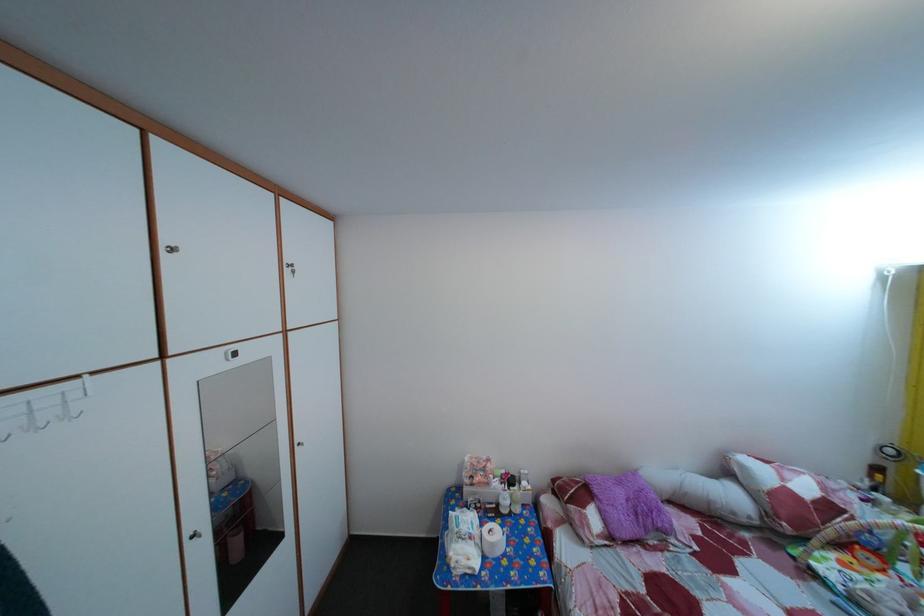
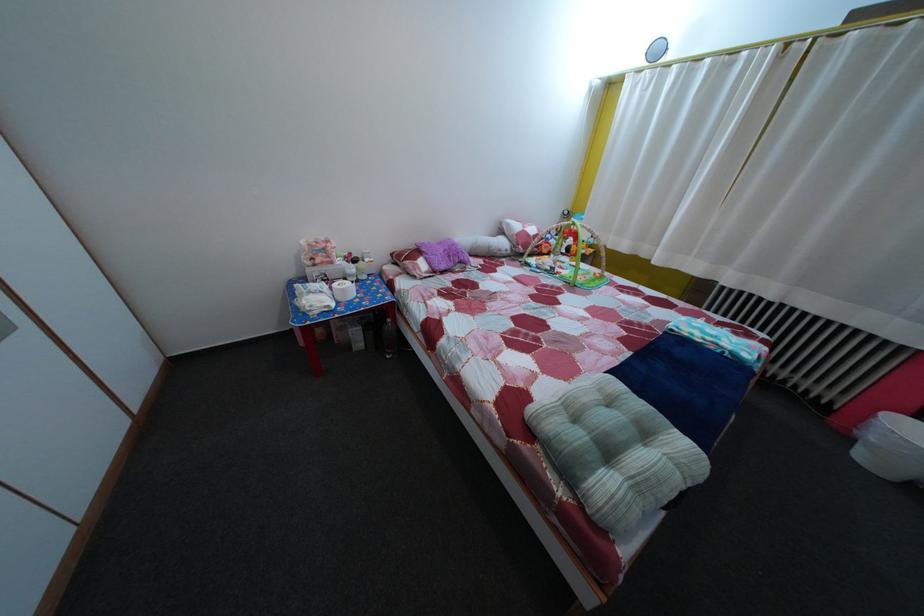
Locate, in the second image, the point that corresponds to (x=489, y=509) in the first image.

(335, 284)